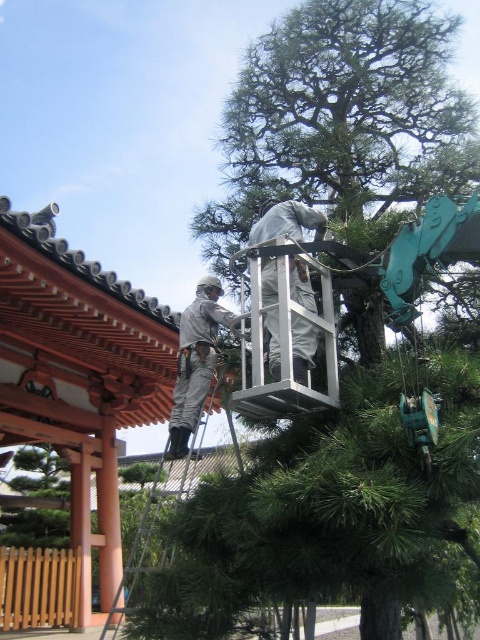
Question: Can you confirm if metallic silver ladder at center is thinner than gray fabric at center?

Choices:
 (A) yes
 (B) no

Answer: (B)

Question: Is metallic silver ladder at center closer to camera compared to gray fabric at center?

Choices:
 (A) yes
 (B) no

Answer: (A)

Question: Which point appears closest to the camera in this image?

Choices:
 (A) (180, 397)
 (B) (131, 595)
 (C) (453, 33)
 (D) (304, 348)

Answer: (D)

Question: Does green textured tree at upper center have a smaller size compared to gray fabric at center?

Choices:
 (A) yes
 (B) no

Answer: (A)

Question: Which of the following is the closest to the observer?

Choices:
 (A) metallic silver ladder at center
 (B) green textured tree at upper center
 (C) gray fabric worker at center

Answer: (A)

Question: Considering the real-world distances, which object is closest to the metallic silver ladder at center?

Choices:
 (A) gray fabric at center
 (B) gray fabric worker at center

Answer: (B)